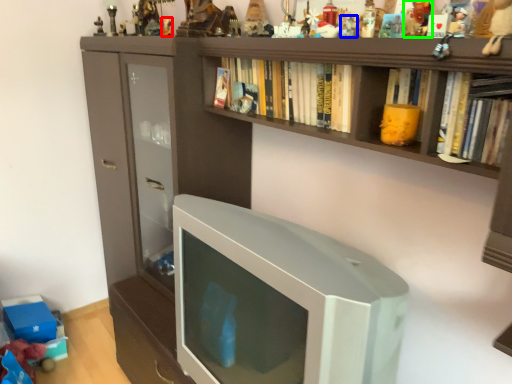
Question: Which object is positioned farthest from toy (highlighted by a red box)? Select from toy (highlighted by a blue box) and toy (highlighted by a green box).

Choices:
 (A) toy
 (B) toy

Answer: (B)